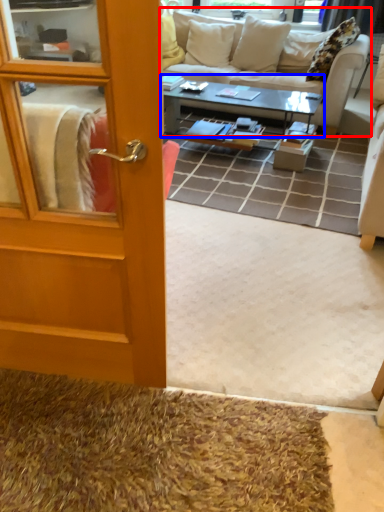
Question: Which point is closer to the camera, studio couch (highlighted by a red box) or coffee table (highlighted by a blue box)?

Choices:
 (A) studio couch
 (B) coffee table

Answer: (B)